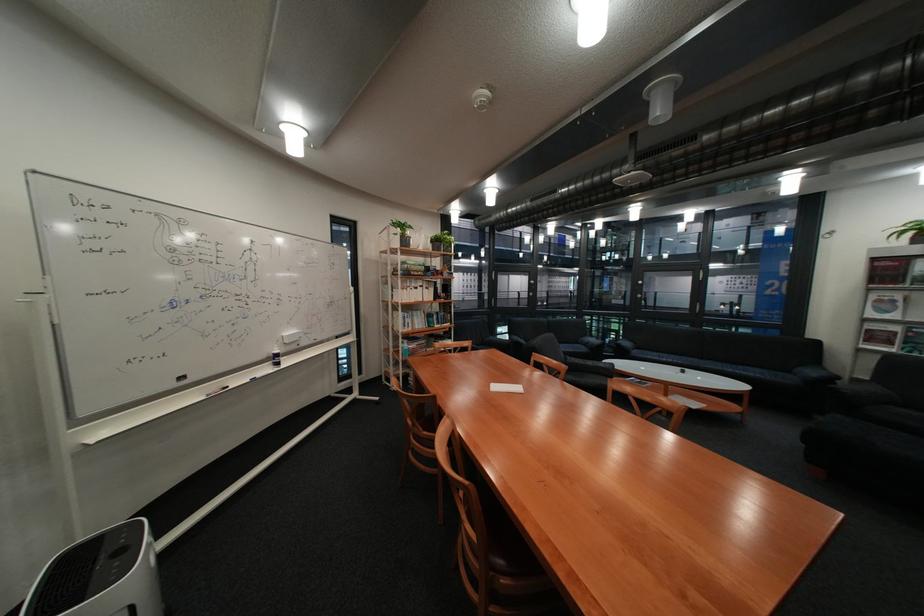
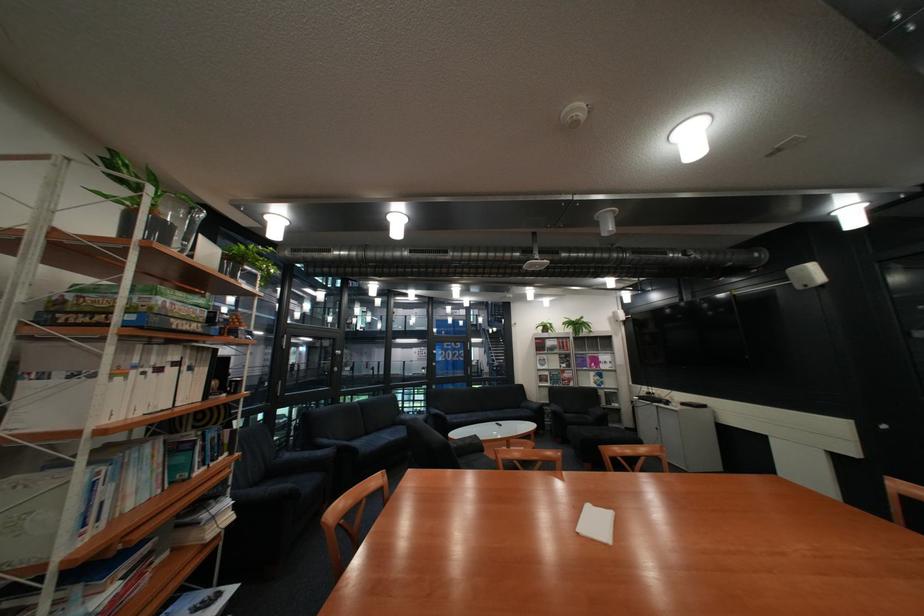
Locate, in the second image, the point that corresponds to (x=433, y=313) in the first image.

(163, 448)